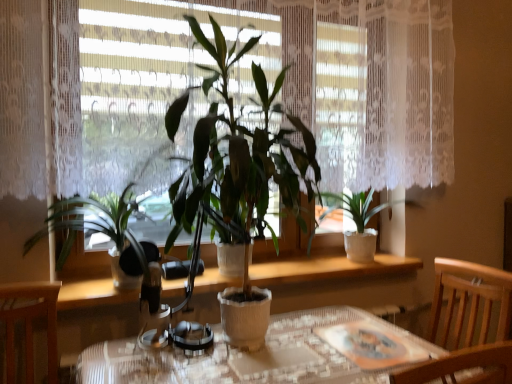
Where is `metallic silver headphones at center`? Image resolution: width=512 pixels, height=384 pixels. metallic silver headphones at center is located at coordinates (192, 337).

The height and width of the screenshot is (384, 512). Describe the element at coordinates (361, 221) in the screenshot. I see `white textured pot at center, arranged as the 1th houseplant when viewed from the right` at that location.

I want to click on white textured window sill at center, so click(x=336, y=281).

Describe the element at coordinates (336, 281) in the screenshot. I see `white textured window sill at center` at that location.

Where is `metallic silver headphones at center`? This screenshot has height=384, width=512. metallic silver headphones at center is located at coordinates (192, 337).

From a real-world perspective, is white textured pot at center, arranged as the 1th houseplant when viewed from the right, under green leafy plant at center?

Yes, from a real-world perspective, white textured pot at center, arranged as the 1th houseplant when viewed from the right, is beneath green leafy plant at center.

How distant is white textured pot at center, arranged as the 3th houseplant when viewed from the left, from green leafy plant at center?

white textured pot at center, arranged as the 3th houseplant when viewed from the left, and green leafy plant at center are 19.41 inches apart.

Is white textured pot at center, arranged as the 1th houseplant when viewed from the right, facing towards green leafy plant at center?

No.

Is white textured pot at center, arranged as the 1th houseplant when viewed from the right, far from green leafy plant at center?

That's not correct — white textured pot at center, arranged as the 1th houseplant when viewed from the right, is a little close to green leafy plant at center.

Is metallic silver headphones at center next to wooden chair at lower right?

No, metallic silver headphones at center is not making contact with wooden chair at lower right.

Does metallic silver headphones at center have a smaller size compared to wooden chair at lower right?

Yes.

Is point (186, 342) less distant than point (450, 376)?

No, (186, 342) is behind (450, 376).

Would you say metallic silver headphones at center is outside wooden chair at lower right?

Yes, metallic silver headphones at center is not within wooden chair at lower right.

What's the angular difference between white textured pot at center, arranged as the 1th houseplant when viewed from the right, and wooden chair at lower right's facing directions?

white textured pot at center, arranged as the 1th houseplant when viewed from the right, and wooden chair at lower right are facing 86 degrees away from each other.

Does white textured pot at center, arranged as the 1th houseplant when viewed from the right, have a lesser width compared to wooden chair at lower right?

Yes, white textured pot at center, arranged as the 1th houseplant when viewed from the right, is thinner than wooden chair at lower right.

From the image's perspective, who appears lower, white textured pot at center, arranged as the 1th houseplant when viewed from the right, or wooden chair at lower right?

wooden chair at lower right is shown below in the image.

From the image's perspective, relative to green matte plant at center, which is the 2th houseplant in left-to-right order, is white textured pot at center, arranged as the 3th houseplant when viewed from the left, above or below?

white textured pot at center, arranged as the 3th houseplant when viewed from the left, is below green matte plant at center, which is the 2th houseplant in left-to-right order.

Is white textured pot at center, arranged as the 3th houseplant when viewed from the left, wider or thinner than green matte plant at center, which is the 2th houseplant in left-to-right order?

Considering their sizes, white textured pot at center, arranged as the 3th houseplant when viewed from the left, looks slimmer than green matte plant at center, which is the 2th houseplant in left-to-right order.

Which is closer to the camera, [332,196] or [201,130]?

Clearly, point [332,196] is more distant from the camera than point [201,130].

Is white textured pot at center, arranged as the 1th houseplant when viewed from the right, positioned with its back to green matte plant at center, which is the 2th houseplant in left-to-right order?

No.

Is textured glass table at center next to white textured pot at center, arranged as the 3th houseplant when viewed from the left, and touching it?

No, textured glass table at center is not touching white textured pot at center, arranged as the 3th houseplant when viewed from the left.

From a real-world perspective, is textured glass table at center located higher than white textured pot at center, arranged as the 3th houseplant when viewed from the left?

No, from a real-world perspective, textured glass table at center is not over white textured pot at center, arranged as the 3th houseplant when viewed from the left

Is textured glass table at center outside of white textured pot at center, arranged as the 1th houseplant when viewed from the right?

Indeed, textured glass table at center is completely outside white textured pot at center, arranged as the 1th houseplant when viewed from the right.

Looking at this image, could you measure the distance between textured glass table at center and white textured pot at center, arranged as the 1th houseplant when viewed from the right?

They are 25.81 inches apart.

What's the angular difference between white textured window sill at center and white textured pot at center, arranged as the 1th houseplant when viewed from the right,'s facing directions?

0.713 degrees.

Is white textured window sill at center looking in the opposite direction of white textured pot at center, arranged as the 1th houseplant when viewed from the right?

No, white textured window sill at center is not facing away from white textured pot at center, arranged as the 1th houseplant when viewed from the right.

From the image's perspective, between white textured window sill at center and white textured pot at center, arranged as the 1th houseplant when viewed from the right, who is located below?

white textured window sill at center.

From a real-world perspective, starting from the white textured window sill at center, which houseplant is the 2nd one vertically above it? Please provide its 2D coordinates.

[(361, 221)]

Can you confirm if white textured window sill at center is thinner than wooden chair at lower right?

Indeed, white textured window sill at center has a lesser width compared to wooden chair at lower right.

Considering the sizes of objects white textured window sill at center and wooden chair at lower right in the image provided, who is shorter, white textured window sill at center or wooden chair at lower right?

white textured window sill at center is shorter.

Is there a large distance between white textured window sill at center and wooden chair at lower right?

No, there isn't a large distance between white textured window sill at center and wooden chair at lower right.

Is white textured window sill at center in front of or behind wooden chair at lower right in the image?

Clearly, white textured window sill at center is behind wooden chair at lower right.

Locate an element on the screen. The image size is (512, 384). the 2nd houseplant below when counting from the green leafy plant at center (from the image's perspective) is located at coordinates (361, 221).

Find the location of a particular element. The image size is (512, 384). tableware above the wooden chair at lower right (from a real-world perspective) is located at coordinates (192, 337).

In the scene shown: Which object lies nearer to the anchor point white textured window sill at center, green matte plant at center, which appears as the third houseplant when viewed from the right, or metallic silver headphones at center?

green matte plant at center, which appears as the third houseplant when viewed from the right.

Looking at this image, when comparing their distances from green leafy plant at center, does white textured pot at center, arranged as the 3th houseplant when viewed from the left, or green matte plant at center, which is the 2th houseplant in right-to-left order, seem closer?

The object closer to green leafy plant at center is green matte plant at center, which is the 2th houseplant in right-to-left order.

Which object lies further to the anchor point metallic silver headphones at center, green leafy plant at center or green matte plant at center, which is the 2th houseplant in right-to-left order?

Based on the image, green leafy plant at center appears to be further to metallic silver headphones at center.

When comparing their distances from wooden chair at lower right, does textured glass table at center or green matte plant at center, which is the 2th houseplant in right-to-left order, seem closer?

Based on the image, textured glass table at center appears to be nearer to wooden chair at lower right.

Which object lies nearer to the anchor point green leafy plant at center, green matte plant at center, which is the 2th houseplant in left-to-right order, or textured glass table at center?

green matte plant at center, which is the 2th houseplant in left-to-right order.

Which object lies nearer to the anchor point green matte plant at center, which is the 2th houseplant in left-to-right order, metallic silver headphones at center or green leafy plant at center?

Among the two, green leafy plant at center is located nearer to green matte plant at center, which is the 2th houseplant in left-to-right order.

Based on their spatial positions, is green matte plant at center, which appears as the third houseplant when viewed from the right, or green leafy plant at center closer to green matte plant at center, which is the 2th houseplant in left-to-right order?

green leafy plant at center.

Based on their spatial positions, is textured glass table at center or green matte plant at center, which is the 2th houseplant in right-to-left order, further from white textured window sill at center?

green matte plant at center, which is the 2th houseplant in right-to-left order, is further to white textured window sill at center.

The width and height of the screenshot is (512, 384). In order to click on window sill between textured glass table at center and white textured pot at center, arranged as the 1th houseplant when viewed from the right, along the z-axis in this screenshot , I will do `click(336, 281)`.

The height and width of the screenshot is (384, 512). What are the coordinates of `window between green matte plant at center, which appears as the third houseplant when viewed from the right, and white textured pot at center, arranged as the 1th houseplant when viewed from the right, in the horizontal direction` in the screenshot? It's located at (364, 82).

This screenshot has height=384, width=512. Identify the location of window sill that lies between green matte plant at center, which is the 2th houseplant in left-to-right order, and textured glass table at center from top to bottom. (336, 281).

Identify the location of window sill located between metallic silver headphones at center and wooden chair at lower right in the left-right direction. The height and width of the screenshot is (384, 512). (336, 281).